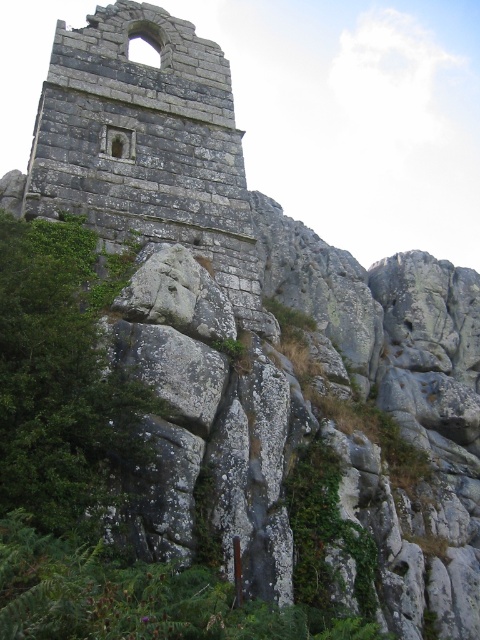
You are hiking near the ancient stone structure and want to place a marker at the closest point to your current position. Which point would you choose between point (36, 198) and point (73, 483)?

Point (73, 483) is closer to the camera than point (36, 198), so you should choose point (73, 483) as it is closer to your current position.

You are a hiker who wants to take a photo of the rusty stone ruins at center and the green leafy tree at lower left. Which object should you stand closer to in order to capture both in a single frame without moving your camera?

You should stand closer to the green leafy tree at lower left because the rusty stone ruins at center is positioned over it, so by moving closer to the tree, you can include both in the frame.

Looking at this image, you are a hiker who wants to take a photo of the rusty stone ruins at center and the green leafy tree at lower left. Which object should you focus on first if you want to capture both in the same frame without moving your camera?

You should focus on the rusty stone ruins at center first because it is taller than the green leafy tree at lower left, so positioning it properly will ensure both fit in the frame.